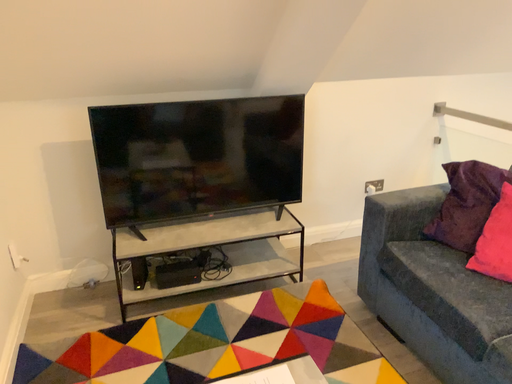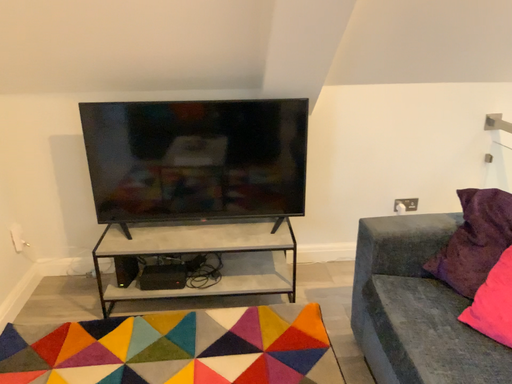
Question: How did the camera likely rotate when shooting the video?

Choices:
 (A) rotated right
 (B) rotated left

Answer: (B)